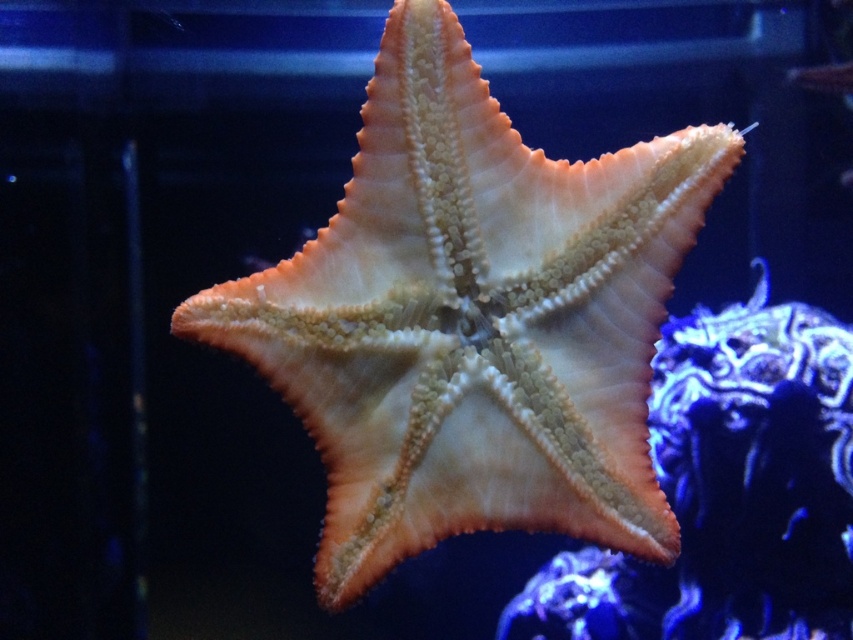
You are an aquarium visitor observing the orange textured starfish at center and the orange rough starfish at center. Which one has a smaller height?

The orange textured starfish at center is shorter than the orange rough starfish at center, so the orange textured starfish at center has a smaller height.

In the scene shown: You are an underwater photographer aiming to capture the starfish in the aquarium. You notice two points in the image labeled as point (473, 470) and point (521, 618). Which point is closer to the camera?

Point (473, 470) is in front of point (521, 618), so it is closer to the camera.

You are standing in an aquarium and see the orange textured starfish at center. If you want to touch it without getting too close, what is the minimum distance you should maintain?

The orange textured starfish at center is 3.98 feet away from the viewer, so you should maintain a minimum distance of 3.98 feet to touch it without getting closer.